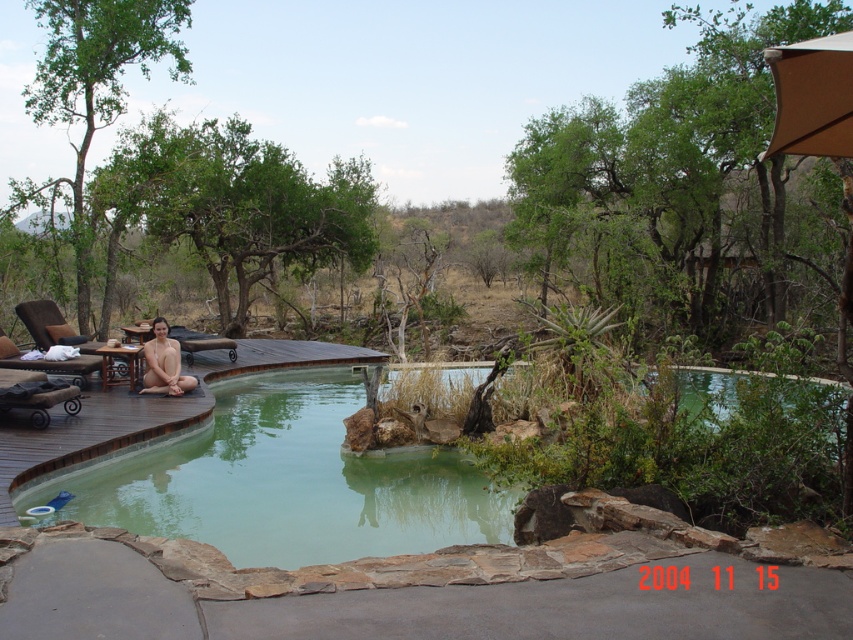
You are planning to install a new lighting system for the green stone pool at center and the brown wooden deck at lower left. Since the deck is lower, where should you place the underwater lights to ensure they are visible from the deck?

The green stone pool at center is above the brown wooden deck at lower left, so placing underwater lights in the pool area will make them visible from the deck below.